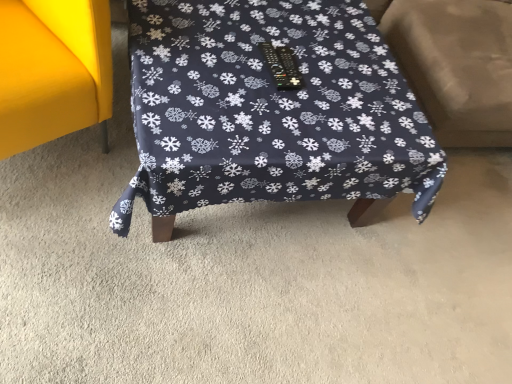
Question: Considering their positions, is matte yellow sofa at left, which appears as the 2th furniture when viewed from the right, located in front of or behind beige fabric swivel chair at right?

Choices:
 (A) behind
 (B) front

Answer: (B)

Question: Choose the correct answer: Is matte yellow sofa at left, acting as the 1th furniture starting from the left, inside beige fabric swivel chair at right or outside it?

Choices:
 (A) outside
 (B) inside

Answer: (A)

Question: Which of these objects is positioned closest to the dark blue fabric table at center, the 1th furniture from the right?

Choices:
 (A) beige fabric swivel chair at right
 (B) matte yellow sofa at left, which appears as the 2th furniture when viewed from the right

Answer: (B)

Question: Based on their relative distances, which object is farther from the dark blue fabric table at center, the 1th furniture from the right?

Choices:
 (A) matte yellow sofa at left, which appears as the 2th furniture when viewed from the right
 (B) beige fabric swivel chair at right

Answer: (B)